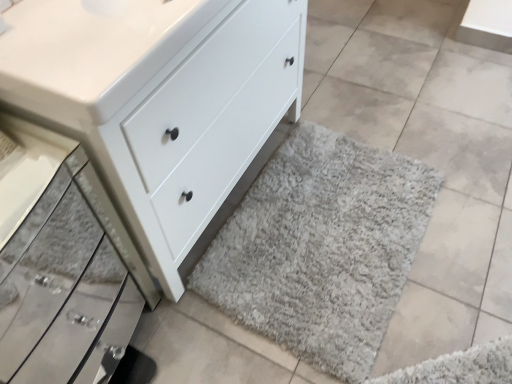
Question: In terms of height, does white matte chest of drawers at lower center look taller or shorter compared to white glossy sink at upper left?

Choices:
 (A) tall
 (B) short

Answer: (A)

Question: Is white matte chest of drawers at lower center in front of or behind white glossy sink at upper left in the image?

Choices:
 (A) behind
 (B) front

Answer: (B)

Question: Estimate the real-world distances between objects in this image. Which object is closer to the white matte chest of drawers at lower center?

Choices:
 (A) satin silver drawer at lower left
 (B) white glossy sink at upper left
 (C) gray shaggy rug at lower right

Answer: (B)

Question: Which object is positioned closest to the satin silver drawer at lower left?

Choices:
 (A) white matte chest of drawers at lower center
 (B) white glossy sink at upper left
 (C) gray shaggy rug at lower right

Answer: (A)